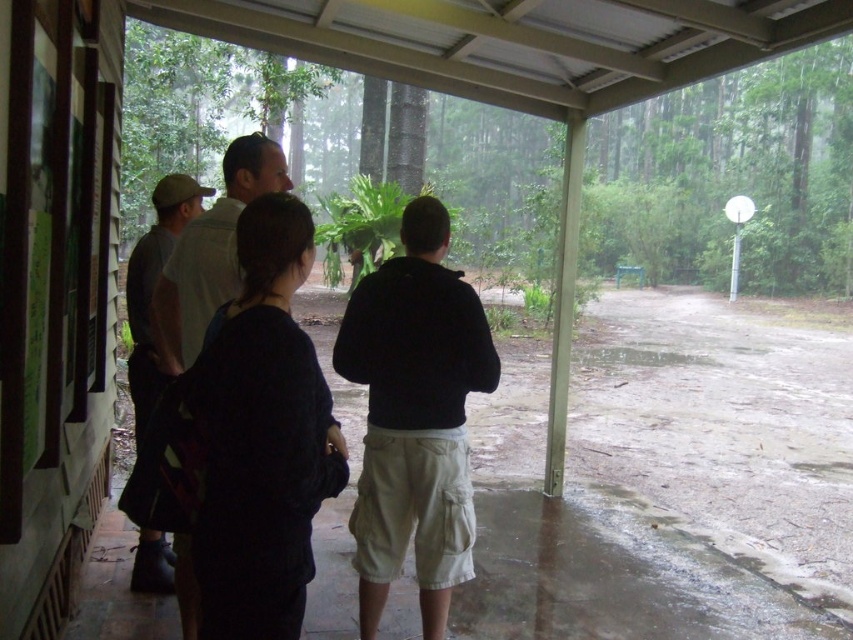
You are standing on the porch and want to pick up the black cotton hoodie at center and dark gray shirt at center. Which one is closer to you?

The black cotton hoodie at center is positioned under the dark gray shirt at center, so the black cotton hoodie at center is closer to you.